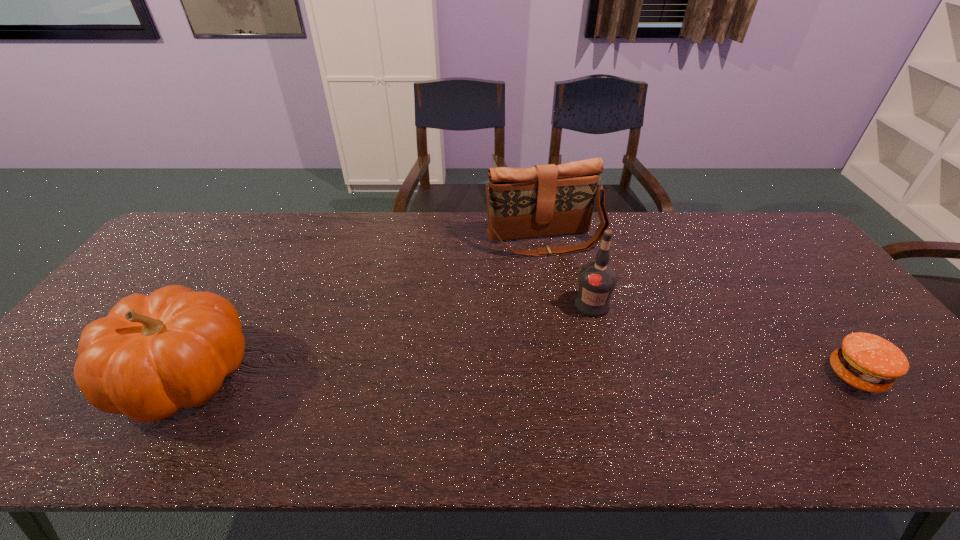
Where is `free spot on the desktop that is between the pumpkin and the rightmost object and is positioned on the front-facing side of the shoulder bag`? This screenshot has height=540, width=960. free spot on the desktop that is between the pumpkin and the rightmost object and is positioned on the front-facing side of the shoulder bag is located at coordinates (601, 375).

This screenshot has width=960, height=540. What are the coordinates of `free spot on the desktop that is between the leftmost object and the shortest object and is positioned on the front label of the third nearest object` in the screenshot? It's located at (619, 375).